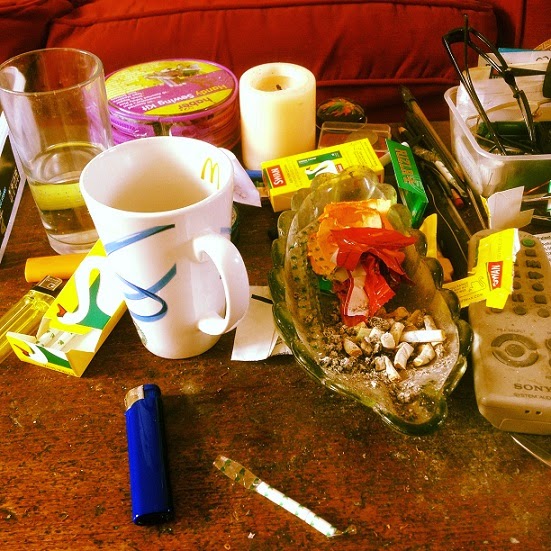
Where is `cup`? The height and width of the screenshot is (551, 551). cup is located at coordinates point(165,291), point(59,120).